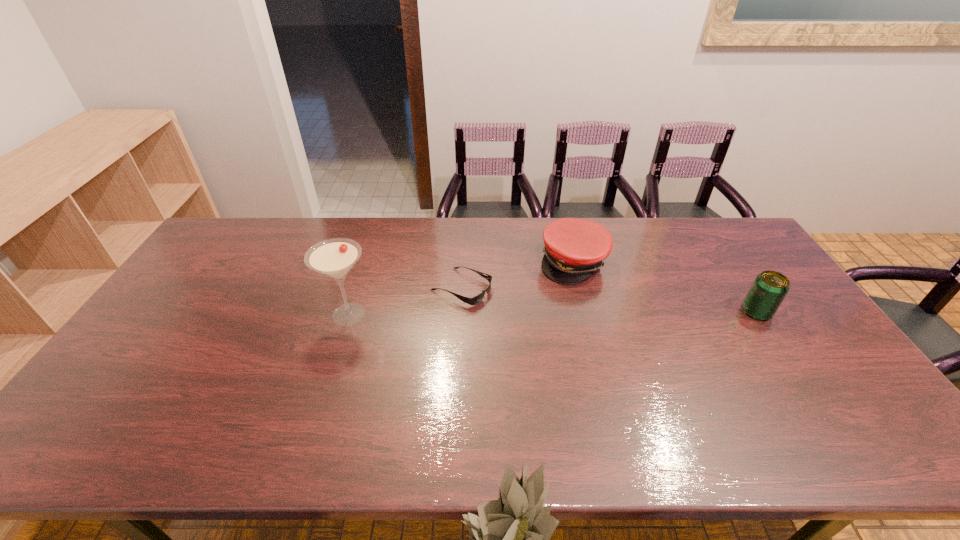
Identify the location of empty space that is in between the martini and the second object from right to left. The height and width of the screenshot is (540, 960). (462, 288).

Point out which object is positioned as the third nearest to the beer can. Please provide its 2D coordinates. Your answer should be formatted as a tuple, i.e. [(x, y)], where the tuple contains the x and y coordinates of a point satisfying the conditions above.

[(334, 258)]

Find the location of a particular element. Image resolution: width=960 pixels, height=540 pixels. object that is the nearest to the tallest object is located at coordinates (475, 300).

Find the location of a particular element. free spot that satisfies the following two spatial constraints: 1. on the front side of the rightmost object; 2. on the left side of the second object from right to left is located at coordinates (587, 312).

You are a GUI agent. You are given a task and a screenshot of the screen. Output one action in this format:
    pyautogui.click(x=<x>, y=<y>)
    Task: Click on the free spot that satisfies the following two spatial constraints: 1. on the front side of the third object from right to left; 2. on the right side of the rightmost object
    
    Given the screenshot: What is the action you would take?
    pyautogui.click(x=461, y=312)

Identify the location of vacant position in the image that satisfies the following two spatial constraints: 1. on the front side of the cap; 2. on the left side of the rightmost object. (587, 312).